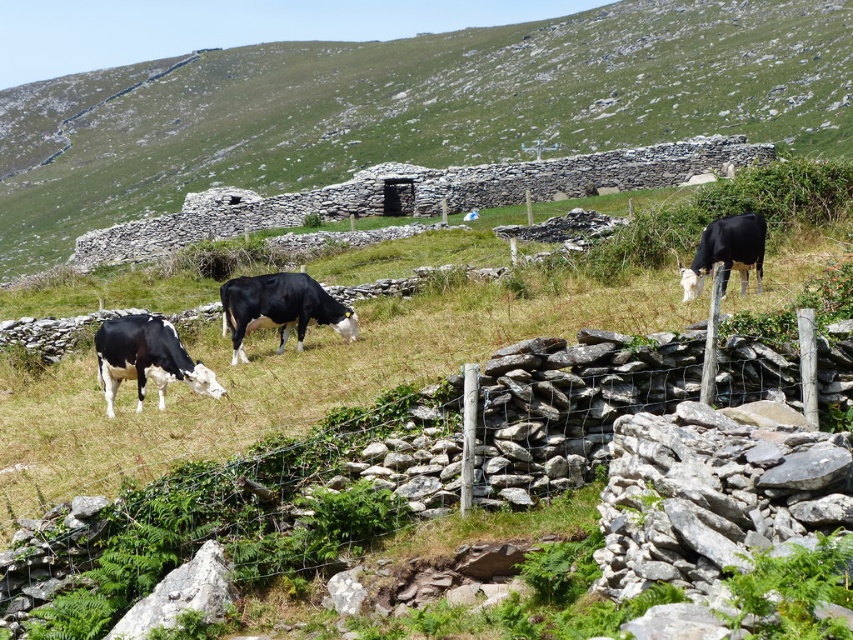
Who is higher up, wire mesh fence at lower left or black glossy cow at lower left?

black glossy cow at lower left

Who is more distant from viewer, (666, 468) or (100, 356)?

Positioned behind is point (100, 356).

The image size is (853, 640). I want to click on wire mesh fence at lower left, so click(x=479, y=476).

Is point (48, 584) behind point (686, 292)?

No.

Who is lower down, wire mesh fence at lower left or black glossy cow at right?

wire mesh fence at lower left is lower down.

At what (x,y) coordinates should I click in order to perform the action: click on wire mesh fence at lower left. Please return your answer as a coordinate pair (x, y). This screenshot has width=853, height=640. Looking at the image, I should click on (479, 476).

Who is positioned more to the right, black cow at center or black glossy cow at center?

From the viewer's perspective, black glossy cow at center appears more on the right side.

Can you confirm if black cow at center is shorter than black glossy cow at center?

No.

Who is more distant from viewer, [555,131] or [316,289]?

The point [555,131] is more distant.

Where is `black cow at center`? black cow at center is located at coordinates (413, 108).